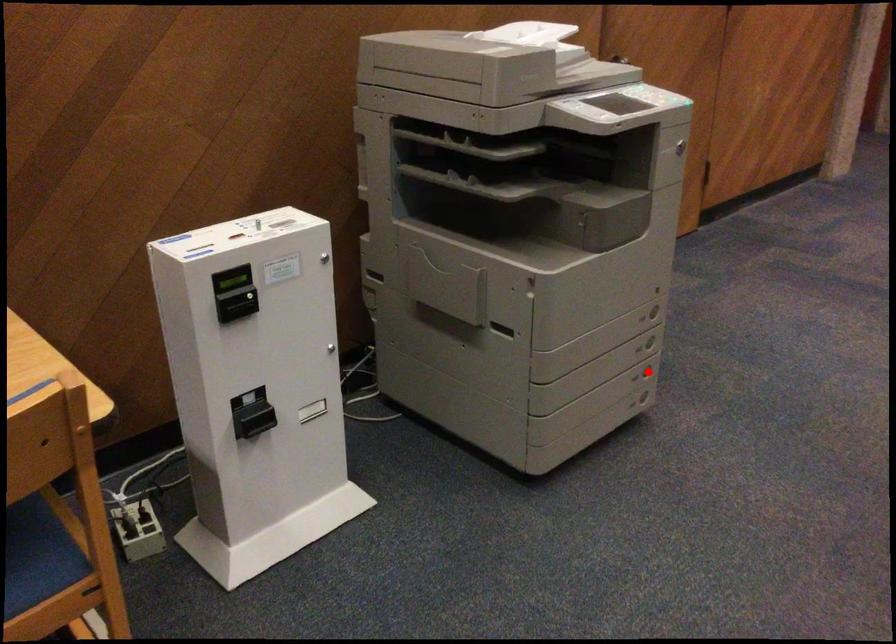
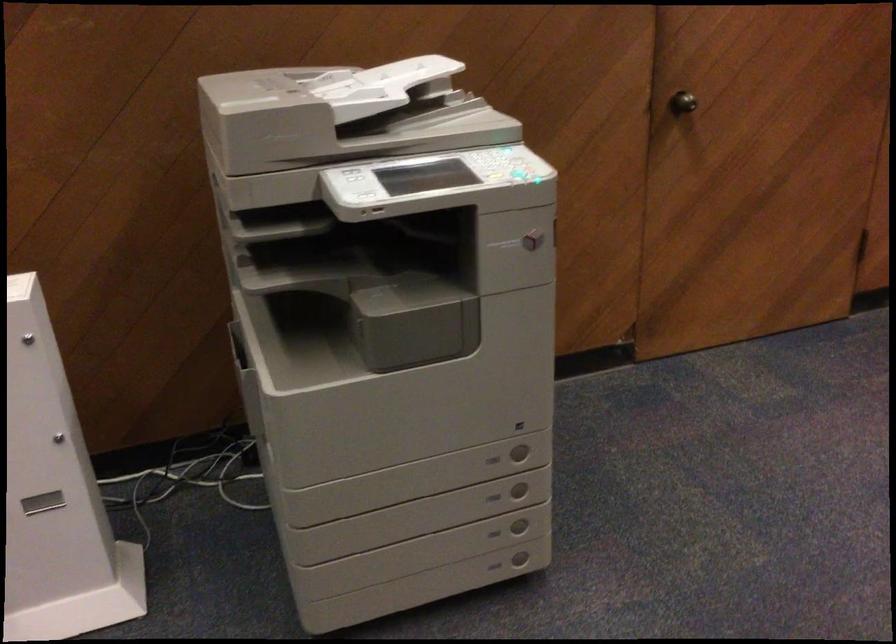
Where in the second image is the point corresponding to the highlighted location from the first image?

(519, 527)